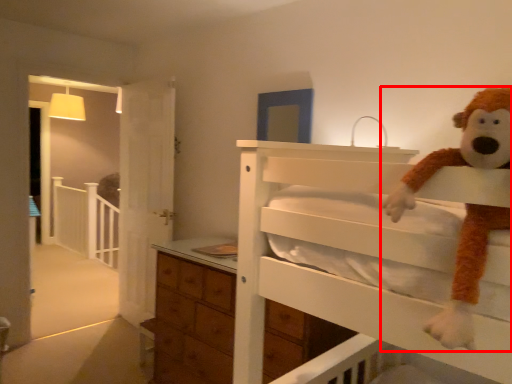
Question: From the image's perspective, what is the correct spatial relationship of toy (annotated by the red box) in relation to balustrade?

Choices:
 (A) above
 (B) below

Answer: (A)